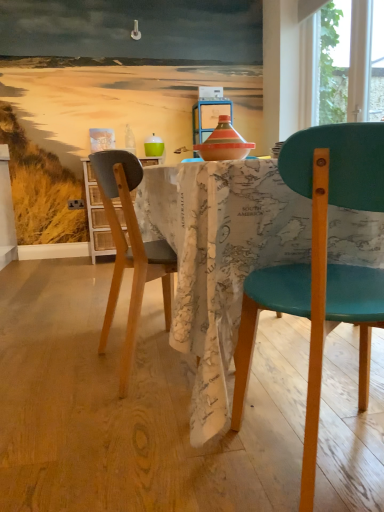
Locate an element on the screen. This screenshot has width=384, height=512. teal plastic chair at right, positioned as the second chair in back-to-front order is located at coordinates (320, 267).

What is the approximate height of wooden cabinet at left?

wooden cabinet at left is 35.14 inches in height.

The image size is (384, 512). What do you see at coordinates (219, 258) in the screenshot? I see `map-patterned fabric at center` at bounding box center [219, 258].

What is the approximate width of white plastic power outlet at lower left?

The width of white plastic power outlet at lower left is 1.28 inches.

In order to click on teal plastic chair at right, positioned as the second chair in back-to-front order in this screenshot , I will do `click(320, 267)`.

Does white plastic power outlet at lower left have a lesser width compared to wooden cabinet at left?

Correct, the width of white plastic power outlet at lower left is less than that of wooden cabinet at left.

Is white plastic power outlet at lower left oriented away from wooden cabinet at left?

No, white plastic power outlet at lower left is not facing away from wooden cabinet at left.

Is white plastic power outlet at lower left not near wooden cabinet at left?

No.

From the image's perspective, is white plastic power outlet at lower left on top of wooden cabinet at left?

Yes.

Is map-patterned fabric at center inside the boundaries of translucent glass bottle at upper center, or outside?

map-patterned fabric at center is not inside translucent glass bottle at upper center, it's outside.

From the picture: In terms of height, does map-patterned fabric at center look taller or shorter compared to translucent glass bottle at upper center?

map-patterned fabric at center is taller than translucent glass bottle at upper center.

Is map-patterned fabric at center touching translucent glass bottle at upper center?

map-patterned fabric at center is not next to translucent glass bottle at upper center, and they're not touching.

Considering the sizes of matte black chair at center, placed as the second chair when sorted from right to left, and translucent glass bottle at upper center in the image, is matte black chair at center, placed as the second chair when sorted from right to left, taller or shorter than translucent glass bottle at upper center?

matte black chair at center, placed as the second chair when sorted from right to left, is taller than translucent glass bottle at upper center.

Can you tell me how much matte black chair at center, placed as the 2th chair when sorted from front to back, and translucent glass bottle at upper center differ in facing direction?

The facing directions of matte black chair at center, placed as the 2th chair when sorted from front to back, and translucent glass bottle at upper center are 90.8 degrees apart.

From the image's perspective, who appears lower, matte black chair at center, the 1th chair viewed from the back, or translucent glass bottle at upper center?

matte black chair at center, the 1th chair viewed from the back, from the image's perspective.

From a real-world perspective, is matte black chair at center, placed as the second chair when sorted from right to left, positioned above or below translucent glass bottle at upper center?

matte black chair at center, placed as the second chair when sorted from right to left, is below translucent glass bottle at upper center.

From a real-world perspective, is matte black chair at center, placed as the first chair when sorted from left to right, above or below transparent glass window at upper right?

matte black chair at center, placed as the first chair when sorted from left to right, is below transparent glass window at upper right.

Where is `the 1st chair in front when counting from the transparent glass window at upper right`? the 1st chair in front when counting from the transparent glass window at upper right is located at coordinates (130, 250).

Does matte black chair at center, placed as the second chair when sorted from right to left, have a larger size compared to transparent glass window at upper right?

Yes.

Which object is positioned more to the left, matte black chair at center, placed as the second chair when sorted from right to left, or transparent glass window at upper right?

matte black chair at center, placed as the second chair when sorted from right to left, is more to the left.

Is map-patterned fabric at center wider or thinner than transparent glass window at upper right?

Clearly, map-patterned fabric at center has more width compared to transparent glass window at upper right.

From the image's perspective, would you say map-patterned fabric at center is positioned over transparent glass window at upper right?

No, from the image's perspective, map-patterned fabric at center is not on top of transparent glass window at upper right.

Between point (251, 207) and point (320, 98), which one is positioned in front?

The point (251, 207) is closer to the camera.

Do you think matte black chair at center, the 1th chair viewed from the back, is within wooden cabinet at left, or outside of it?

matte black chair at center, the 1th chair viewed from the back, is not inside wooden cabinet at left, it's outside.

From a real-world perspective, is matte black chair at center, placed as the second chair when sorted from right to left, beneath wooden cabinet at left?

Correct, in the physical world, matte black chair at center, placed as the second chair when sorted from right to left, is lower than wooden cabinet at left.

Which is closer, (x=133, y=295) or (x=87, y=186)?

Point (x=133, y=295) is closer to the camera than point (x=87, y=186).

Considering the sizes of objects matte black chair at center, placed as the second chair when sorted from right to left, and wooden cabinet at left in the image provided, who is shorter, matte black chair at center, placed as the second chair when sorted from right to left, or wooden cabinet at left?

matte black chair at center, placed as the second chair when sorted from right to left.

Is wooden cabinet at left facing away from translucent glass bottle at upper center?

wooden cabinet at left is not turned away from translucent glass bottle at upper center.

At what (x,y) coordinates should I click in order to perform the action: click on cabinetry below the translucent glass bottle at upper center (from a real-world perspective). Please return your answer as a coordinate pair (x, y). This screenshot has height=512, width=384. Looking at the image, I should click on (97, 217).

Considering the positions of objects wooden cabinet at left and translucent glass bottle at upper center in the image provided, who is more to the right, wooden cabinet at left or translucent glass bottle at upper center?

Positioned to the right is translucent glass bottle at upper center.

At what (x,y) coordinates should I click in order to perform the action: click on power outlet behind the wooden cabinet at left. Please return your answer as a coordinate pair (x, y). Looking at the image, I should click on click(76, 204).

This screenshot has width=384, height=512. In order to click on bottle above the map-patterned fabric at center (from a real-world perspective) in this screenshot , I will do `click(130, 140)`.

Looking at the image, which one is located further to transparent glass window at upper right, teal plastic chair at right, which ranks as the 1th chair in right-to-left order, or map-patterned fabric at center?

Among the two, teal plastic chair at right, which ranks as the 1th chair in right-to-left order, is located further to transparent glass window at upper right.

Estimate the real-world distances between objects in this image. Which object is further from translucent glass bottle at upper center, transparent glass window at upper right or matte black chair at center, placed as the second chair when sorted from right to left?

The object further to translucent glass bottle at upper center is matte black chair at center, placed as the second chair when sorted from right to left.

Based on their spatial positions, is teal plastic chair at right, positioned as the second chair in back-to-front order, or map-patterned fabric at center further from white plastic power outlet at lower left?

teal plastic chair at right, positioned as the second chair in back-to-front order, lies further to white plastic power outlet at lower left than the other object.

Considering their positions, is translucent glass bottle at upper center positioned closer to transparent glass window at upper right than white plastic power outlet at lower left?

Among the two, translucent glass bottle at upper center is located nearer to transparent glass window at upper right.

From the image, which object appears to be nearer to map-patterned fabric at center, wooden cabinet at left or translucent glass bottle at upper center?

The object closer to map-patterned fabric at center is wooden cabinet at left.

Estimate the real-world distances between objects in this image. Which object is closer to translucent glass bottle at upper center, wooden cabinet at left or map-patterned fabric at center?

wooden cabinet at left.

From the image, which object appears to be nearer to white plastic power outlet at lower left, wooden cabinet at left or transparent glass window at upper right?

wooden cabinet at left is closer to white plastic power outlet at lower left.

Which object lies further to the anchor point transparent glass window at upper right, matte black chair at center, placed as the second chair when sorted from right to left, or teal plastic chair at right, positioned as the second chair in back-to-front order?

Among the two, teal plastic chair at right, positioned as the second chair in back-to-front order, is located further to transparent glass window at upper right.

Locate an element on the screen. cabinetry positioned between matte black chair at center, placed as the first chair when sorted from left to right, and white plastic power outlet at lower left from near to far is located at coordinates (97, 217).

In order to click on kitchen & dining room table between teal plastic chair at right, positioned as the second chair in back-to-front order, and transparent glass window at upper right from front to back in this screenshot , I will do `click(219, 258)`.

Find the location of a particular element. chair between teal plastic chair at right, which ranks as the 1th chair in right-to-left order, and white plastic power outlet at lower left, along the z-axis is located at coordinates (130, 250).

Find the location of a particular element. The height and width of the screenshot is (512, 384). chair located between teal plastic chair at right, positioned as the second chair in back-to-front order, and transparent glass window at upper right in the depth direction is located at coordinates [x=130, y=250].